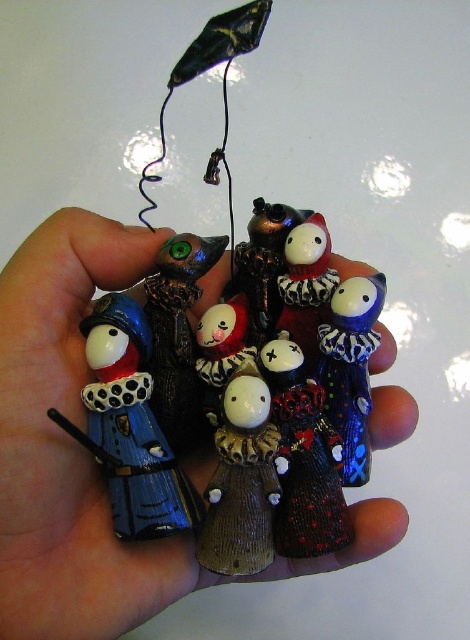
Question: Can you confirm if matte blue wood figure at left is positioned to the right of blue glossy clown at center?

Choices:
 (A) no
 (B) yes

Answer: (A)

Question: Which point is closer to the camera?

Choices:
 (A) (130, 516)
 (B) (172, 381)

Answer: (A)

Question: Which object is the farthest from the shiny metallic figure at center?

Choices:
 (A) matte ceramic figurines at center
 (B) brown textured figurine at center

Answer: (A)

Question: Among these points, which one is nearest to the camera?

Choices:
 (A) (349, 298)
 (B) (106, 417)

Answer: (B)

Question: Does brown textured figurine at center lie in front of blue glossy clown at center?

Choices:
 (A) yes
 (B) no

Answer: (A)

Question: Is matte black raven at center above porcelain clown at center?

Choices:
 (A) yes
 (B) no

Answer: (B)